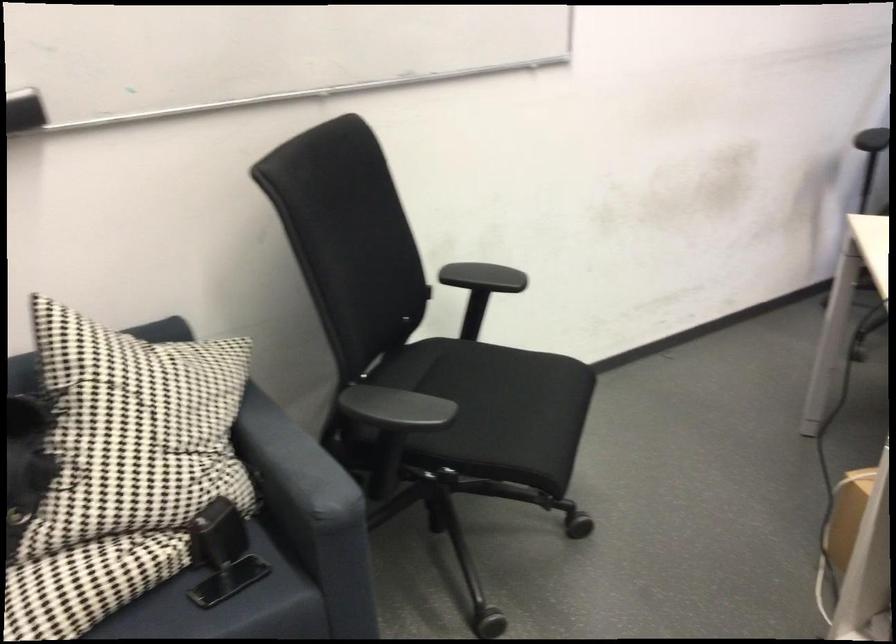
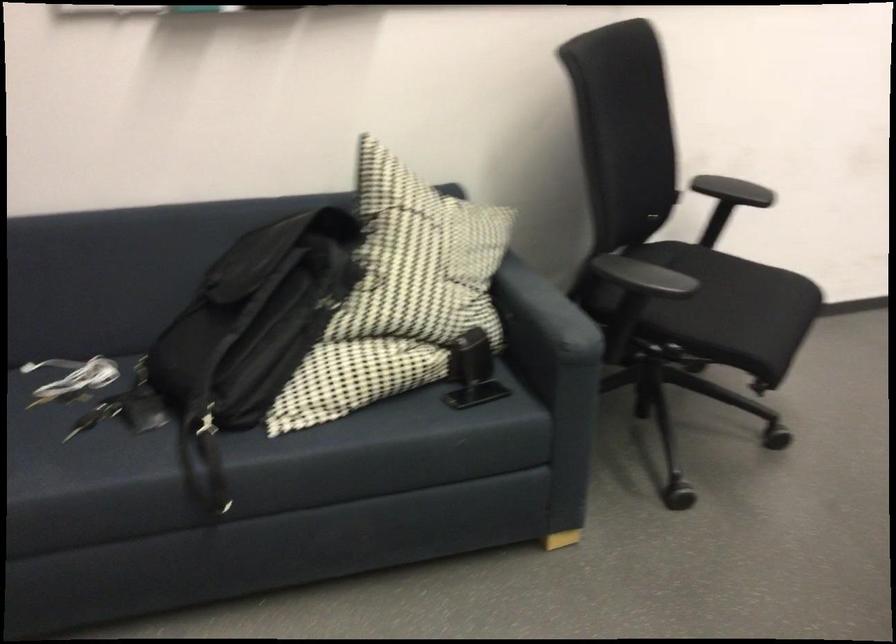
Question: The camera is either moving clockwise (left) or counter-clockwise (right) around the object. The first image is from the beginning of the video and the second image is from the end. Is the camera moving left or right when shooting the video?

Choices:
 (A) Left
 (B) Right

Answer: (B)